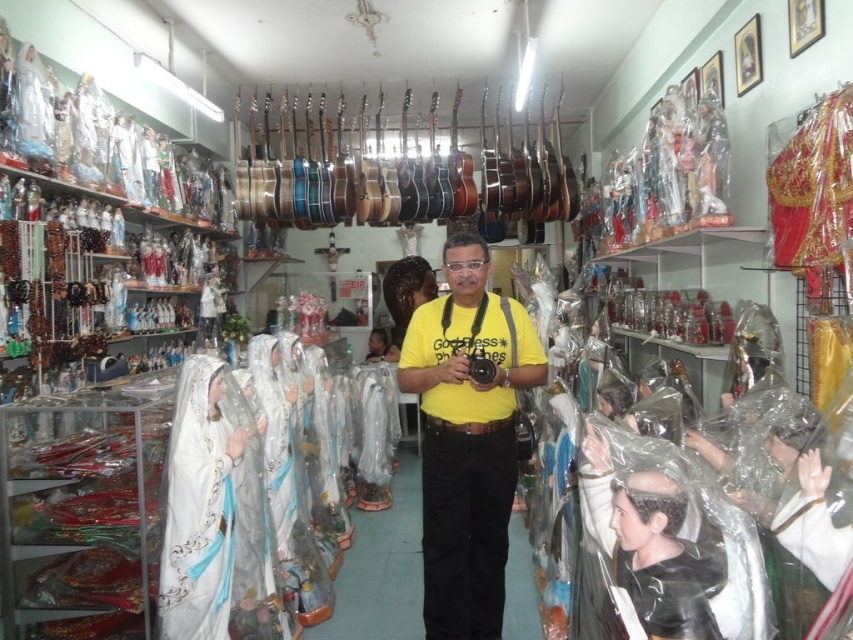
Question: Which point is closer to the camera?

Choices:
 (A) white glossy statue at center
 (B) yellow cotton t-shirt at center

Answer: (A)

Question: Which point is closer to the camera?

Choices:
 (A) white glossy statue at center
 (B) yellow cotton t-shirt at center

Answer: (A)

Question: Is yellow cotton t-shirt at center positioned before white glossy statue at center?

Choices:
 (A) no
 (B) yes

Answer: (A)

Question: Where is yellow cotton t-shirt at center located in relation to white glossy statue at center in the image?

Choices:
 (A) below
 (B) above

Answer: (B)

Question: Observing the image, what is the correct spatial positioning of yellow cotton t-shirt at center in reference to white glossy statue at center?

Choices:
 (A) right
 (B) left

Answer: (A)

Question: Which point appears farthest from the camera in this image?

Choices:
 (A) (427, 401)
 (B) (244, 520)

Answer: (A)